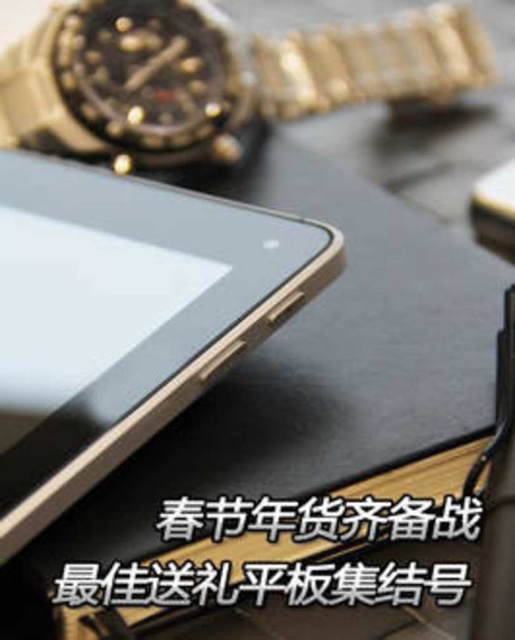
In the scene shown: Who is taller, gold metallic tablet at upper left or gold metallic watch at upper left?

With more height is gold metallic tablet at upper left.

Which is in front, point (279, 220) or point (398, 16)?

Point (279, 220)

This screenshot has width=515, height=640. Describe the element at coordinates (152, 330) in the screenshot. I see `gold metallic tablet at upper left` at that location.

Locate an element on the screen. Image resolution: width=515 pixels, height=640 pixels. gold metallic tablet at upper left is located at coordinates (152, 330).